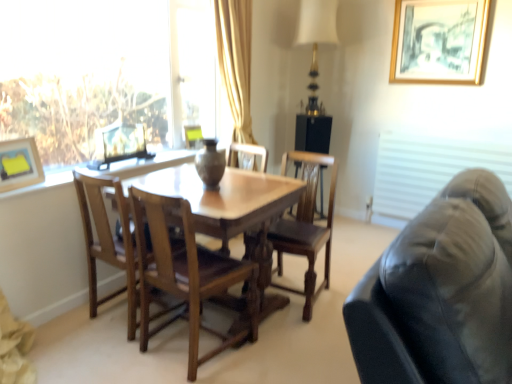
Identify the location of free point above white fabric blind at right (from a real-world perspective). (445, 131).